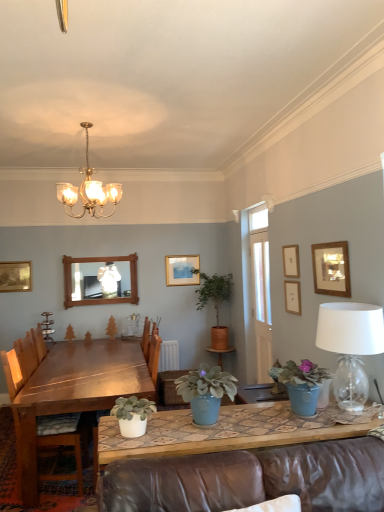
Question: Is matte gold picture frame at upper center, arranged as the 1th picture frame when viewed from the back, thinner than wooden mirror at upper center?

Choices:
 (A) yes
 (B) no

Answer: (A)

Question: Can you confirm if matte gold picture frame at upper center, which ranks as the fourth picture frame in right-to-left order, is wider than wooden mirror at upper center?

Choices:
 (A) yes
 (B) no

Answer: (B)

Question: From the image's perspective, does matte gold picture frame at upper center, arranged as the 1th picture frame when viewed from the back, appear lower than wooden mirror at upper center?

Choices:
 (A) no
 (B) yes

Answer: (A)

Question: From the image's perspective, is matte gold picture frame at upper center, arranged as the 2th picture frame when viewed from the left, over wooden mirror at upper center?

Choices:
 (A) yes
 (B) no

Answer: (A)

Question: Could you tell me if matte gold picture frame at upper center, the 5th picture frame viewed from the front, is facing wooden mirror at upper center?

Choices:
 (A) no
 (B) yes

Answer: (A)

Question: From a real-world perspective, does matte gold picture frame at upper center, arranged as the 1th picture frame when viewed from the back, stand above wooden mirror at upper center?

Choices:
 (A) yes
 (B) no

Answer: (A)

Question: Considering the relative sizes of green matte plant at center, the second plant from the left, and wooden picture frame at upper center, which appears as the fourth picture frame when viewed from the back, in the image provided, is green matte plant at center, the second plant from the left, smaller than wooden picture frame at upper center, which appears as the fourth picture frame when viewed from the back,?

Choices:
 (A) no
 (B) yes

Answer: (B)

Question: Is green matte plant at center, the first plant in the right-to-left sequence, to the left of wooden picture frame at upper center, which appears as the fourth picture frame when viewed from the back, from the viewer's perspective?

Choices:
 (A) no
 (B) yes

Answer: (B)

Question: Is green matte plant at center, which is the 1th plant in back-to-front order, oriented towards wooden picture frame at upper center, positioned as the second picture frame in front-to-back order?

Choices:
 (A) yes
 (B) no

Answer: (B)

Question: Is green matte plant at center, the second plant from the left, facing away from wooden picture frame at upper center, the third picture frame viewed from the left?

Choices:
 (A) yes
 (B) no

Answer: (B)

Question: Are green matte plant at center, the first plant in the right-to-left sequence, and wooden picture frame at upper center, which appears as the fourth picture frame when viewed from the back, making contact?

Choices:
 (A) no
 (B) yes

Answer: (A)

Question: Considering the relative sizes of green matte plant at center, which is the 1th plant in back-to-front order, and wooden picture frame at upper center, which appears as the fourth picture frame when viewed from the back, in the image provided, is green matte plant at center, which is the 1th plant in back-to-front order, thinner than wooden picture frame at upper center, which appears as the fourth picture frame when viewed from the back,?

Choices:
 (A) yes
 (B) no

Answer: (B)

Question: Is green matte plant at center, the 2th plant positioned from the back, at the left side of wooden chair at left?

Choices:
 (A) no
 (B) yes

Answer: (B)